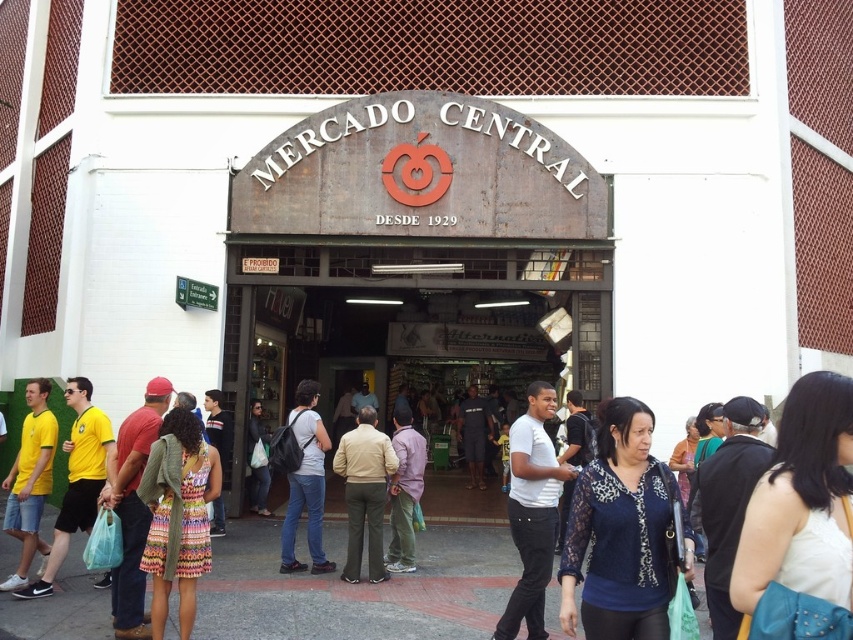
You are standing at the entrance of Mercado Central and notice a white matte shirt at center. Based on its position, can you determine if it is closer to the entrance or the back of the market?

The white matte shirt at center is located at point 0.800 on the x and 0.625 on the y, which places it closer to the back of the market rather than the entrance.

You are a customer at Mercado Central market and you see a white matte shirt at center and a yellow fabric shirt at left. Which shirt is positioned lower in the display?

The white matte shirt at center is positioned below the yellow fabric shirt at left, so it is lower in the display.